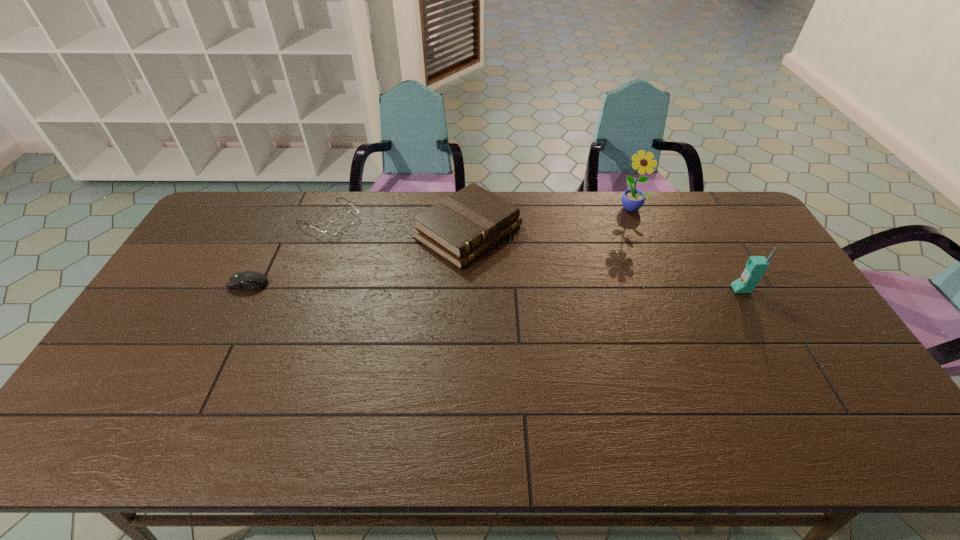
The height and width of the screenshot is (540, 960). I want to click on free location located on the button of the shortest object, so click(209, 284).

You are a GUI agent. You are given a task and a screenshot of the screen. Output one action in this format:
    pyautogui.click(x=<x>, y=<y>)
    Task: Click on the vacant position located on the keypad of the rightmost object
    This screenshot has height=540, width=960.
    Given the screenshot: What is the action you would take?
    pyautogui.click(x=689, y=289)

Where is `vacant space situated 0.360m on the keypad of the rightmost object`? This screenshot has height=540, width=960. vacant space situated 0.360m on the keypad of the rightmost object is located at coordinates (613, 289).

Locate an element on the screen. vacant region located on the keypad of the rightmost object is located at coordinates (636, 289).

What are the coordinates of `free space located 0.140m on the front-facing side of the sunflower` in the screenshot? It's located at (609, 234).

Locate an element on the screen. Image resolution: width=960 pixels, height=540 pixels. free space located on the front-facing side of the sunflower is located at coordinates (616, 225).

The image size is (960, 540). Identify the location of free space located 0.190m on the front-facing side of the sunflower. (602, 241).

Where is `free region located 0.140m on the spine side of the third object from right to left`? This screenshot has height=540, width=960. free region located 0.140m on the spine side of the third object from right to left is located at coordinates (544, 279).

This screenshot has width=960, height=540. Find the location of `free space located on the spine side of the third object from right to left`. free space located on the spine side of the third object from right to left is located at coordinates (579, 300).

This screenshot has width=960, height=540. What are the coordinates of `free spot located on the spine side of the third object from right to left` in the screenshot? It's located at (560, 288).